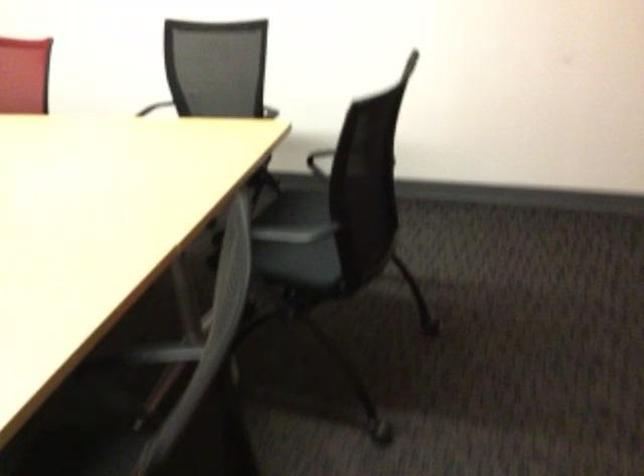
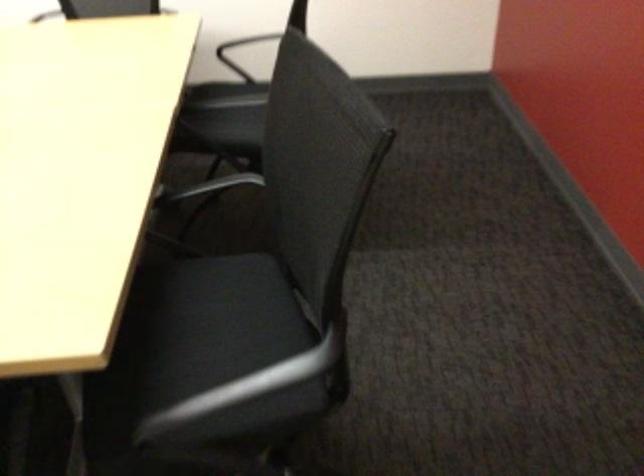
The point at (308,213) is marked in the first image. Where is the corresponding point in the second image?

(230, 101)